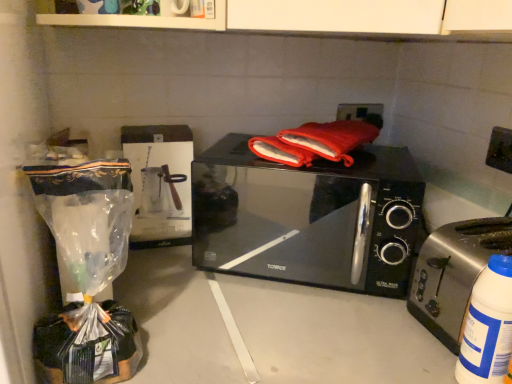
Question: Considering the relative sizes of black glossy microwave at center and white plastic bottle at lower right in the image provided, is black glossy microwave at center shorter than white plastic bottle at lower right?

Choices:
 (A) yes
 (B) no

Answer: (B)

Question: Is black glossy microwave at center not inside white plastic bottle at lower right?

Choices:
 (A) yes
 (B) no

Answer: (A)

Question: Could you tell me if black glossy microwave at center is facing white plastic bottle at lower right?

Choices:
 (A) no
 (B) yes

Answer: (A)

Question: Is black glossy microwave at center thinner than white plastic bottle at lower right?

Choices:
 (A) no
 (B) yes

Answer: (A)

Question: Is black glossy microwave at center at the right side of white plastic bottle at lower right?

Choices:
 (A) yes
 (B) no

Answer: (B)

Question: Does black glossy microwave at center have a smaller size compared to white plastic bottle at lower right?

Choices:
 (A) no
 (B) yes

Answer: (A)

Question: Does satin silver toaster at right contain white plastic bottle at lower right?

Choices:
 (A) no
 (B) yes

Answer: (A)

Question: Considering the relative sizes of satin silver toaster at right and white plastic bottle at lower right in the image provided, is satin silver toaster at right smaller than white plastic bottle at lower right?

Choices:
 (A) yes
 (B) no

Answer: (B)

Question: Does satin silver toaster at right have a lesser width compared to white plastic bottle at lower right?

Choices:
 (A) no
 (B) yes

Answer: (A)

Question: From the image's perspective, is satin silver toaster at right under white plastic bottle at lower right?

Choices:
 (A) yes
 (B) no

Answer: (B)

Question: Is satin silver toaster at right oriented towards white plastic bottle at lower right?

Choices:
 (A) yes
 (B) no

Answer: (B)

Question: From a real-world perspective, is satin silver toaster at right positioned under white plastic bottle at lower right based on gravity?

Choices:
 (A) yes
 (B) no

Answer: (B)

Question: Is black glossy microwave at center taller than satin silver toaster at right?

Choices:
 (A) yes
 (B) no

Answer: (A)